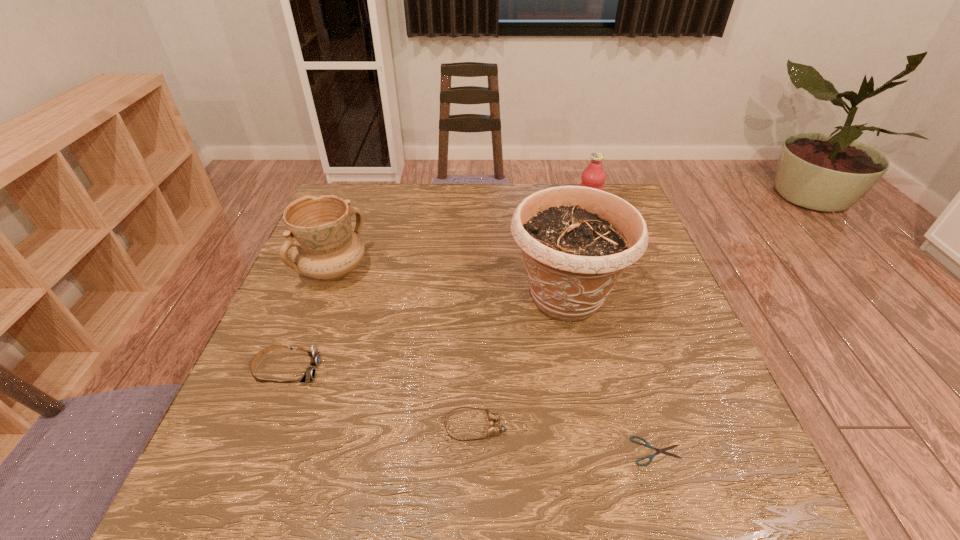
Image resolution: width=960 pixels, height=540 pixels. I want to click on vacant point located between the flowerpot and the shears, so click(x=612, y=374).

Where is `free point between the farthest object and the shortest object`? free point between the farthest object and the shortest object is located at coordinates (621, 335).

Identify the location of unoccupied position between the fifth tallest object and the shears. (565, 438).

Locate an element on the screen. The image size is (960, 540). unoccupied position between the third object from left to right and the third nearest object is located at coordinates (381, 398).

Locate an element on the screen. unoccupied position between the flowerpot and the pottery is located at coordinates (450, 284).

You are a GUI agent. You are given a task and a screenshot of the screen. Output one action in this format:
    pyautogui.click(x=<x>, y=<y>)
    Task: Click on the free point between the pottery and the farthest object
    
    Given the screenshot: What is the action you would take?
    pyautogui.click(x=460, y=244)

At what (x,y) coordinates should I click in order to perform the action: click on vacant space that's between the nearer goggles and the farther goggles. Please return your answer as a coordinate pair (x, y). Looking at the image, I should click on (381, 398).

The width and height of the screenshot is (960, 540). In order to click on empty location between the pottery and the shears in this screenshot , I will do `click(495, 360)`.

Where is `object that stands as the second closest to the shortest object`? object that stands as the second closest to the shortest object is located at coordinates (493, 429).

Image resolution: width=960 pixels, height=540 pixels. In order to click on object that is the third nearest to the shorter goggles in this screenshot , I will do tap(310, 373).